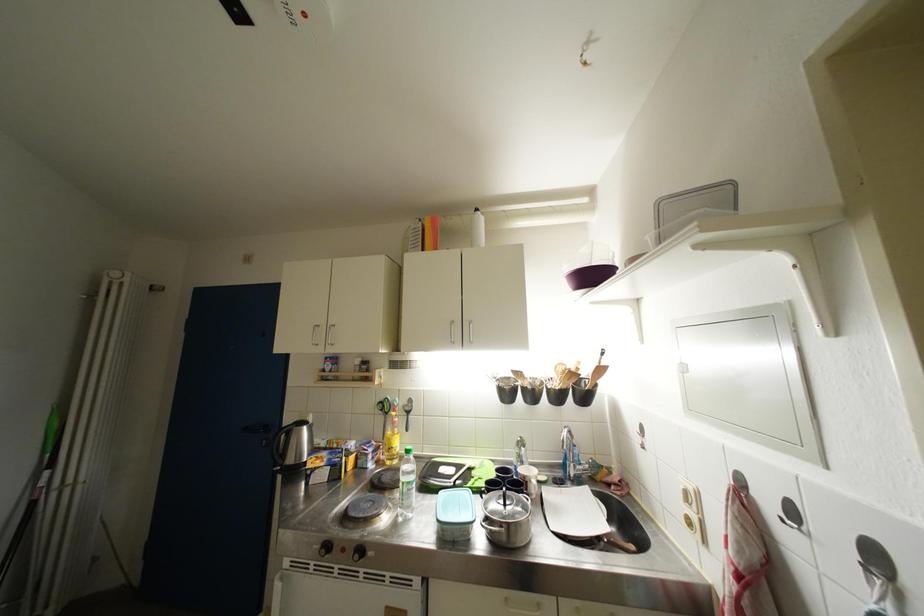
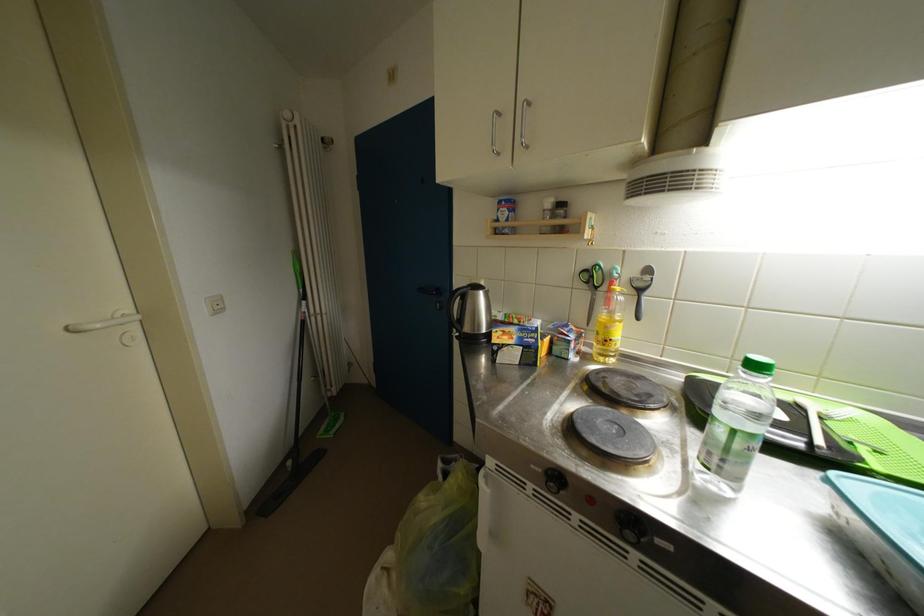
How did the camera likely rotate?

The camera rotated toward left-down.